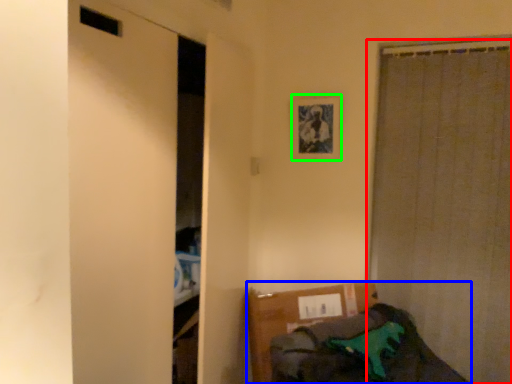
Question: Which object is positioned closest to curtain (highlighted by a red box)? Select from furniture (highlighted by a blue box) and picture frame (highlighted by a green box).

Choices:
 (A) furniture
 (B) picture frame

Answer: (B)